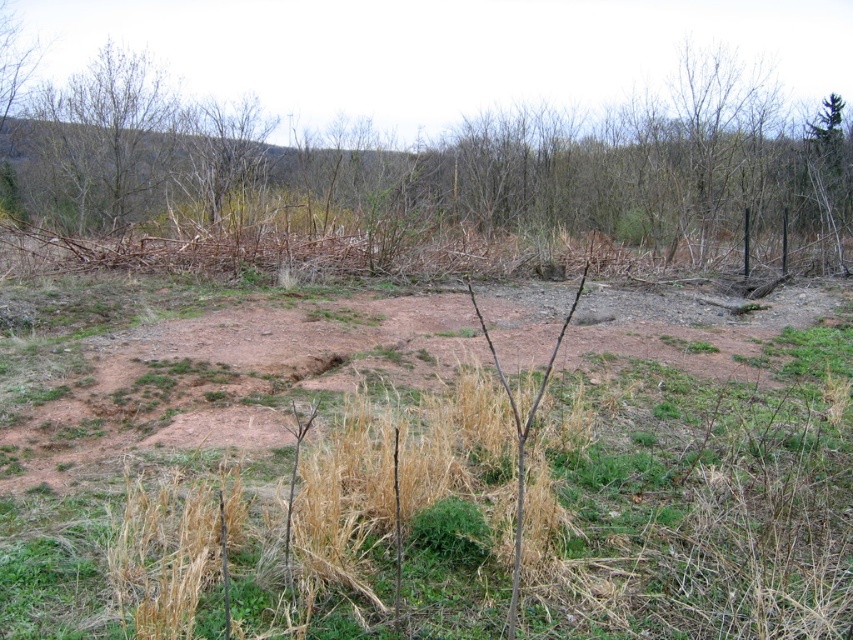
Who is more forward, (704, 74) or (56, 198)?

Point (704, 74) is more forward.

Which is above, brown dry grass at upper center or bare branches at upper left?

Positioned higher is bare branches at upper left.

Measure the distance between brown dry grass at upper center and camera.

brown dry grass at upper center and camera are 27.40 feet apart.

Find the location of a particular element. The height and width of the screenshot is (640, 853). brown dry grass at upper center is located at coordinates coord(432,164).